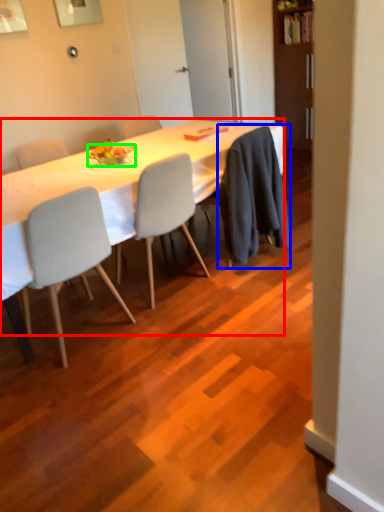
Question: Estimate the real-world distances between objects in this image. Which object is farther from desk (highlighted by a red box), robe (highlighted by a blue box) or plate (highlighted by a green box)?

Choices:
 (A) robe
 (B) plate

Answer: (A)